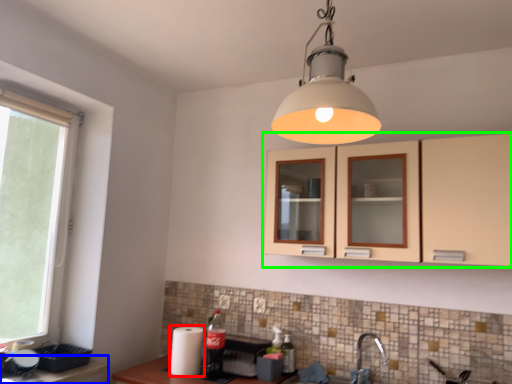
Question: Which is farther away from appliance (highlighted by a red box)? counter top (highlighted by a blue box) or cabinetry (highlighted by a green box)?

Choices:
 (A) counter top
 (B) cabinetry

Answer: (B)